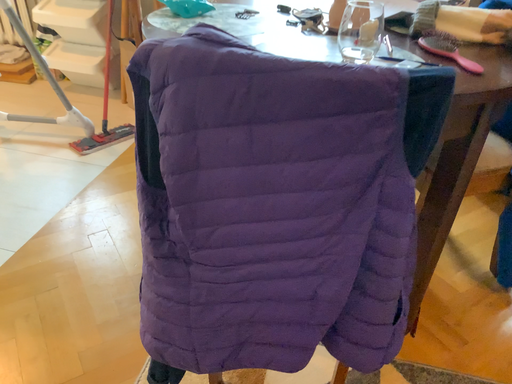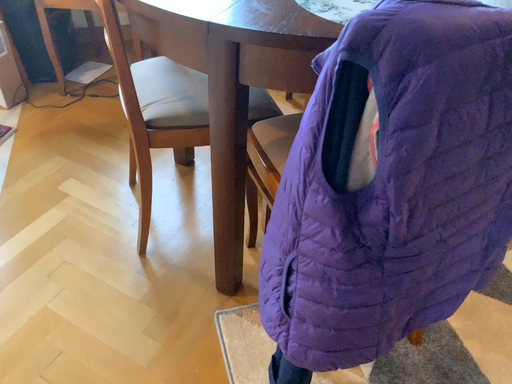
Question: How did the camera likely rotate when shooting the video?

Choices:
 (A) rotated right
 (B) rotated left

Answer: (A)